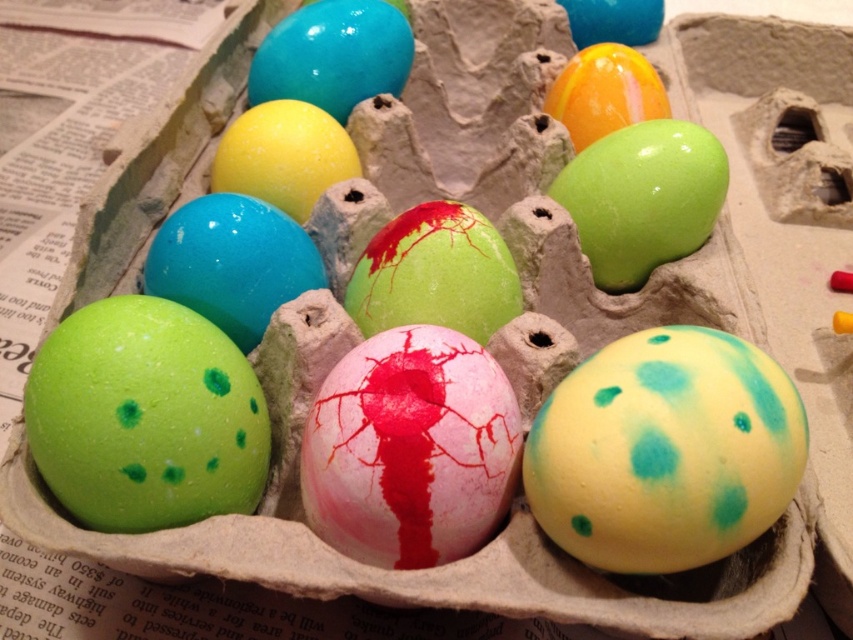
Question: Does yellow-green spotted egg at center-right have a lesser width compared to matte pink egg at center?

Choices:
 (A) no
 (B) yes

Answer: (A)

Question: Which point is closer to the camera?

Choices:
 (A) green matte egg at center
 (B) glossy green egg at center
 (C) glossy plastic egg at upper center
 (D) matte pink egg at center

Answer: (D)

Question: Does matte pink egg at center have a smaller size compared to matte blue egg at center?

Choices:
 (A) yes
 (B) no

Answer: (A)

Question: Where is green matte egg at center located in relation to glossy plastic egg at upper center in the image?

Choices:
 (A) below
 (B) above

Answer: (A)

Question: Which of the following is the closest to the observer?

Choices:
 (A) (769, 436)
 (B) (488, 301)
 (C) (636, 212)

Answer: (A)

Question: Which object is farther from the camera taking this photo?

Choices:
 (A) matte pink egg at center
 (B) green matte egg at lower left
 (C) matte yellow egg at upper right
 (D) matte blue egg at center

Answer: (C)